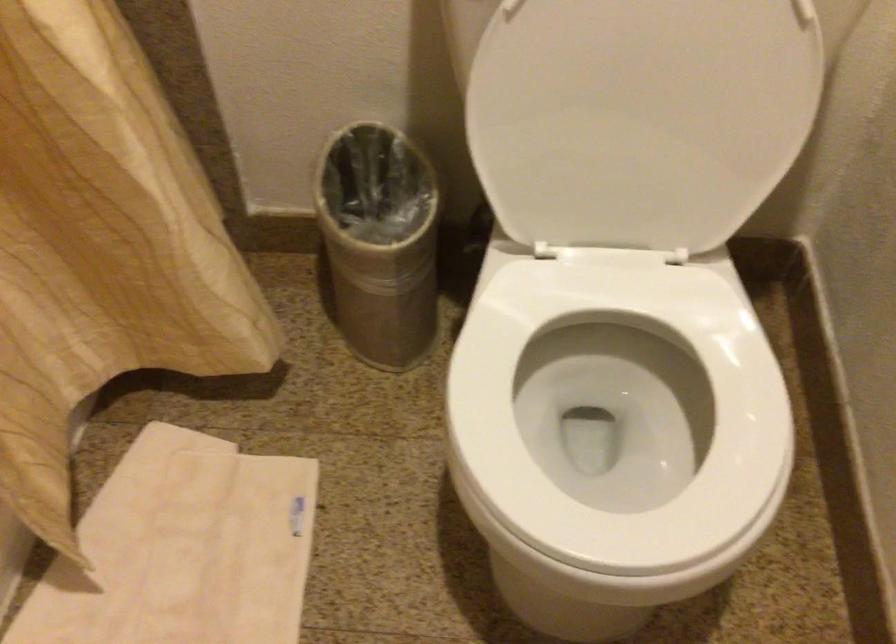
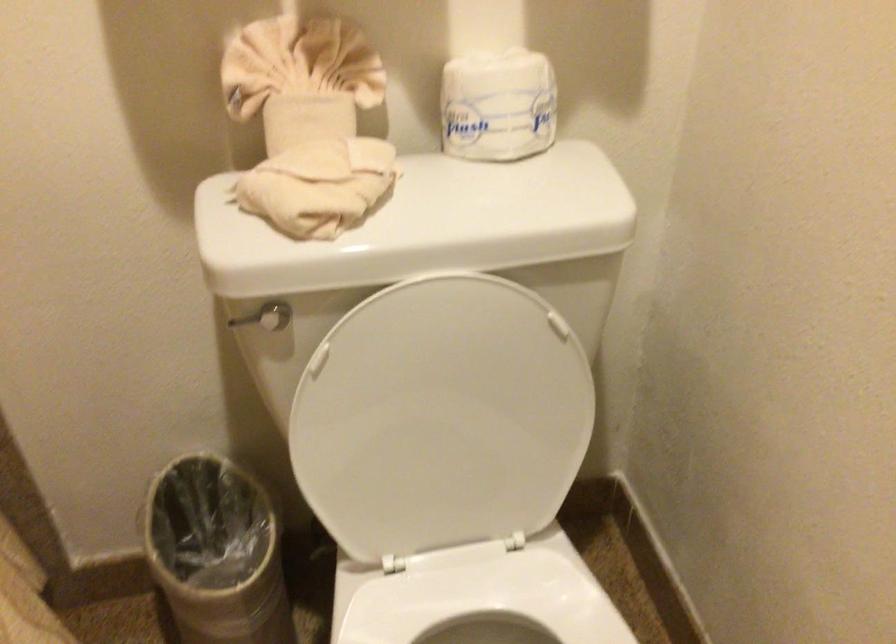
Question: What movement of the cameraman would produce the second image?

Choices:
 (A) Left
 (B) Right
 (C) Forward
 (D) Backward

Answer: (D)